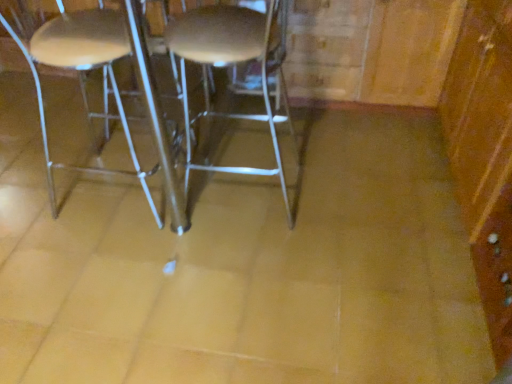
This screenshot has height=384, width=512. Identify the location of unoccupied region to the right of metallic silver stool at left. (220, 191).